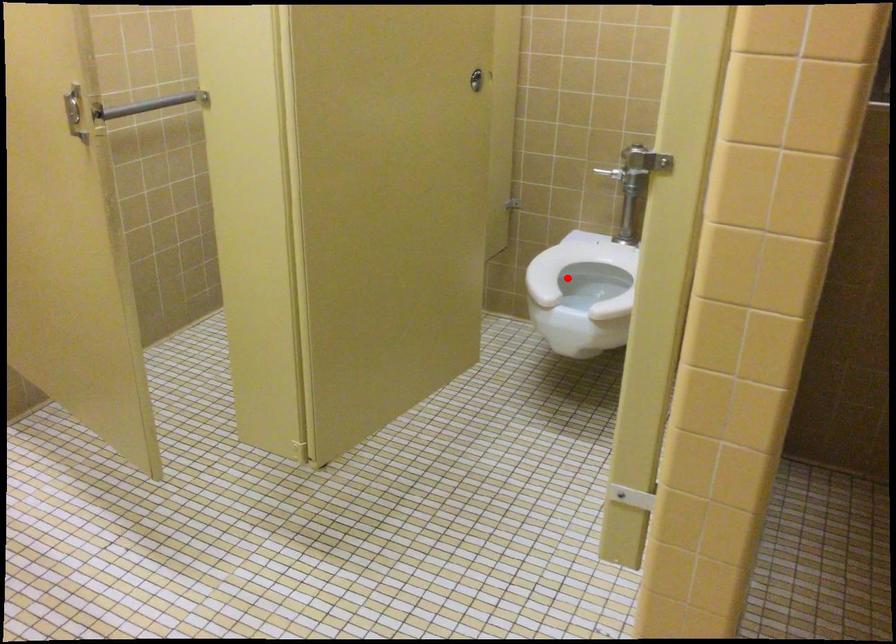
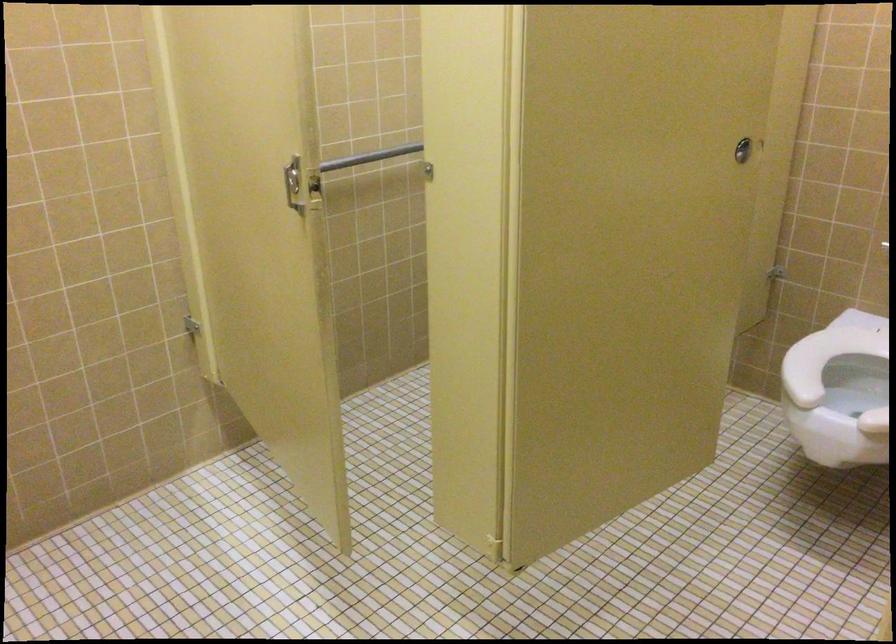
Question: I am providing you with two images of the same scene from different viewpoints. A red point is shown in image1. For the corresponding object point in image2, is it positioned nearer or farther from the camera?

Choices:
 (A) Nearer
 (B) Farther

Answer: (A)